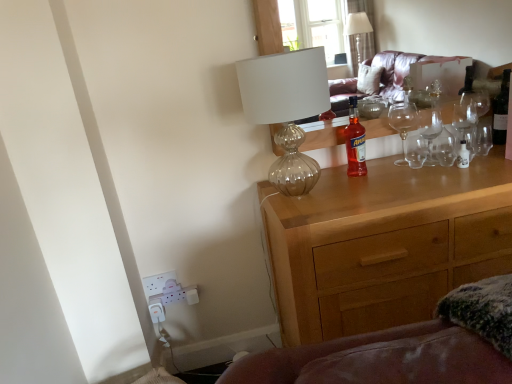
Measure the distance between point (x=289, y=151) and camera.

Point (x=289, y=151) is 5.63 feet away from camera.

What do you see at coordinates (286, 109) in the screenshot? I see `translucent glass lamp at upper center` at bounding box center [286, 109].

Measure the distance between point (324, 338) and camera.

The depth of point (324, 338) is 4.76 feet.

At what (x,y) coordinates should I click in order to perform the action: click on translucent glass lamp at upper center. Please return your answer as a coordinate pair (x, y). The width and height of the screenshot is (512, 384). Looking at the image, I should click on point(286,109).

From the image's perspective, is translucent glass lamp at upper center positioned above or below wooden chest of drawers at center?

Clearly, from the image's perspective, translucent glass lamp at upper center is above wooden chest of drawers at center.

Is translucent glass lamp at upper center oriented towards wooden chest of drawers at center?

No, translucent glass lamp at upper center is not turned towards wooden chest of drawers at center.

Considering the sizes of objects translucent glass lamp at upper center and wooden chest of drawers at center in the image provided, who is shorter, translucent glass lamp at upper center or wooden chest of drawers at center?

Standing shorter between the two is translucent glass lamp at upper center.

Is translucent glass lamp at upper center far from wooden chest of drawers at center?

No, there isn't a large distance between translucent glass lamp at upper center and wooden chest of drawers at center.

Would you say wooden chest of drawers at center is outside translucent glass lamp at upper center?

wooden chest of drawers at center lies outside translucent glass lamp at upper center's area.

From a real-world perspective, between wooden chest of drawers at center and translucent glass lamp at upper center, who is vertically higher?

From a 3D spatial view, translucent glass lamp at upper center is above.

Which is more to the left, wooden chest of drawers at center or translucent glass lamp at upper center?

From the viewer's perspective, translucent glass lamp at upper center appears more on the left side.

Where is `lamp above the wooden chest of drawers at center (from a real-world perspective)`? lamp above the wooden chest of drawers at center (from a real-world perspective) is located at coordinates (286, 109).

How different are the orientations of dark glass wine bottle at upper right and wooden chest of drawers at center in degrees?

There is a 1.85-degree angle between the facing directions of dark glass wine bottle at upper right and wooden chest of drawers at center.

Based on the photo, which of these two, dark glass wine bottle at upper right or wooden chest of drawers at center, is thinner?

dark glass wine bottle at upper right is thinner.

Considering the relative sizes of dark glass wine bottle at upper right and wooden chest of drawers at center in the image provided, is dark glass wine bottle at upper right bigger than wooden chest of drawers at center?

No.

From a real-world perspective, is translucent glass bottle at center located beneath translucent glass lamp at upper center?

Correct, in the physical world, translucent glass bottle at center is lower than translucent glass lamp at upper center.

How far apart are translucent glass bottle at center and translucent glass lamp at upper center?

They are 28.10 centimeters apart.

How different are the orientations of translucent glass bottle at center and translucent glass lamp at upper center in degrees?

The facing directions of translucent glass bottle at center and translucent glass lamp at upper center are 4.17 degrees apart.

Does translucent glass bottle at center turn towards translucent glass lamp at upper center?

No, translucent glass bottle at center does not turn towards translucent glass lamp at upper center.

Considering the sizes of objects dark glass wine bottle at upper right and translucent glass lamp at upper center in the image provided, who is smaller, dark glass wine bottle at upper right or translucent glass lamp at upper center?

Smaller between the two is dark glass wine bottle at upper right.

From the image's perspective, is dark glass wine bottle at upper right below translucent glass lamp at upper center?

No.

Is there a large distance between dark glass wine bottle at upper right and translucent glass lamp at upper center?

Actually, dark glass wine bottle at upper right and translucent glass lamp at upper center are a little close together.

Based on the photo, from the image's perspective, is translucent glass bottle at center located above or below wooden chest of drawers at center?

From the image's perspective, translucent glass bottle at center appears above wooden chest of drawers at center.

Based on the photo, which of these two, translucent glass bottle at center or wooden chest of drawers at center, is bigger?

wooden chest of drawers at center is bigger.

Which point is more distant from viewer, (352, 165) or (354, 187)?

The point (352, 165) is farther.

Is point (356, 147) positioned before point (493, 127)?

Yes, point (356, 147) is closer to viewer.

Consider the image. Is translucent glass bottle at center far away from dark glass wine bottle at upper right?

No, translucent glass bottle at center is in close proximity to dark glass wine bottle at upper right.

Does translucent glass bottle at center come behind dark glass wine bottle at upper right?

No, translucent glass bottle at center is in front of dark glass wine bottle at upper right.

I want to click on wine bottle behind the translucent glass bottle at center, so click(501, 110).

What are the coordinates of `the chest of drawers that appears below the translucent glass lamp at upper center (from a real-world perspective)` in the screenshot? It's located at (384, 244).

In the image, there is a wooden chest of drawers at center. Identify the location of lamp above it (from the image's perspective). (286, 109).

Consider the image. Estimate the real-world distances between objects in this image. Which object is closer to dark glass wine bottle at upper right, translucent glass bottle at center or wooden chest of drawers at center?

The object closer to dark glass wine bottle at upper right is translucent glass bottle at center.

Considering their positions, is translucent glass lamp at upper center positioned closer to dark glass wine bottle at upper right than wooden chest of drawers at center?

wooden chest of drawers at center lies closer to dark glass wine bottle at upper right than the other object.

Consider the image. When comparing their distances from translucent glass bottle at center, does translucent glass lamp at upper center or dark glass wine bottle at upper right seem closer?

Based on the image, translucent glass lamp at upper center appears to be nearer to translucent glass bottle at center.

Considering their positions, is translucent glass lamp at upper center positioned further to translucent glass bottle at center than wooden chest of drawers at center?

Based on the image, wooden chest of drawers at center appears to be further to translucent glass bottle at center.

Based on their spatial positions, is dark glass wine bottle at upper right or translucent glass bottle at center closer to translucent glass lamp at upper center?

Based on the image, translucent glass bottle at center appears to be nearer to translucent glass lamp at upper center.

Considering their positions, is translucent glass bottle at center positioned closer to dark glass wine bottle at upper right than translucent glass lamp at upper center?

The object closer to dark glass wine bottle at upper right is translucent glass bottle at center.

Considering their positions, is wooden chest of drawers at center positioned further to translucent glass bottle at center than dark glass wine bottle at upper right?

dark glass wine bottle at upper right is positioned further to the anchor translucent glass bottle at center.

From the image, which object appears to be nearer to translucent glass lamp at upper center, wooden chest of drawers at center or translucent glass bottle at center?

translucent glass bottle at center.

I want to click on bottle between translucent glass lamp at upper center and dark glass wine bottle at upper right, so click(355, 142).

Locate an element on the screen. chest of drawers between translucent glass lamp at upper center and dark glass wine bottle at upper right is located at coordinates (384, 244).

This screenshot has width=512, height=384. I want to click on bottle between dark glass wine bottle at upper right and wooden chest of drawers at center vertically, so click(x=355, y=142).

This screenshot has width=512, height=384. What are the coordinates of `bottle between translucent glass lamp at upper center and wooden chest of drawers at center in the vertical direction` in the screenshot? It's located at point(355,142).